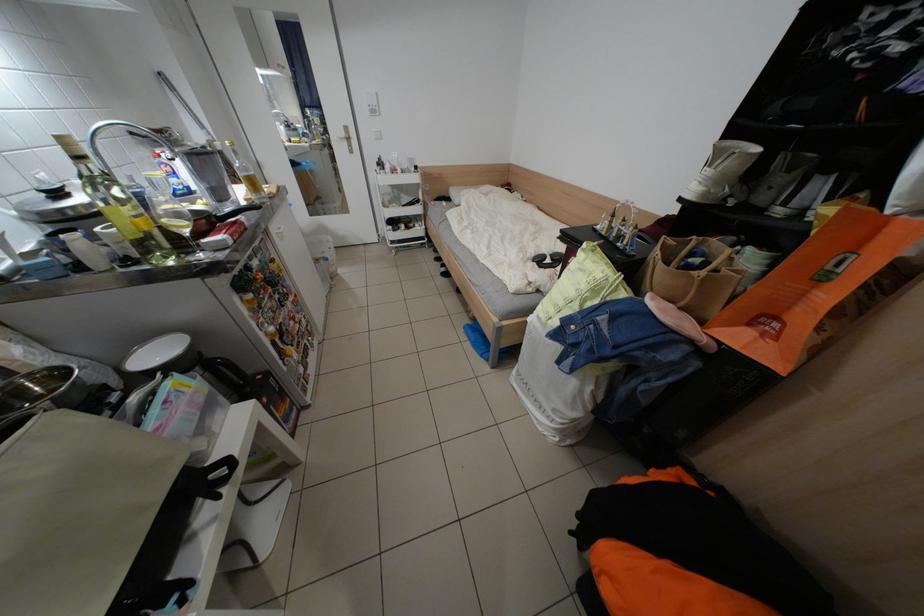
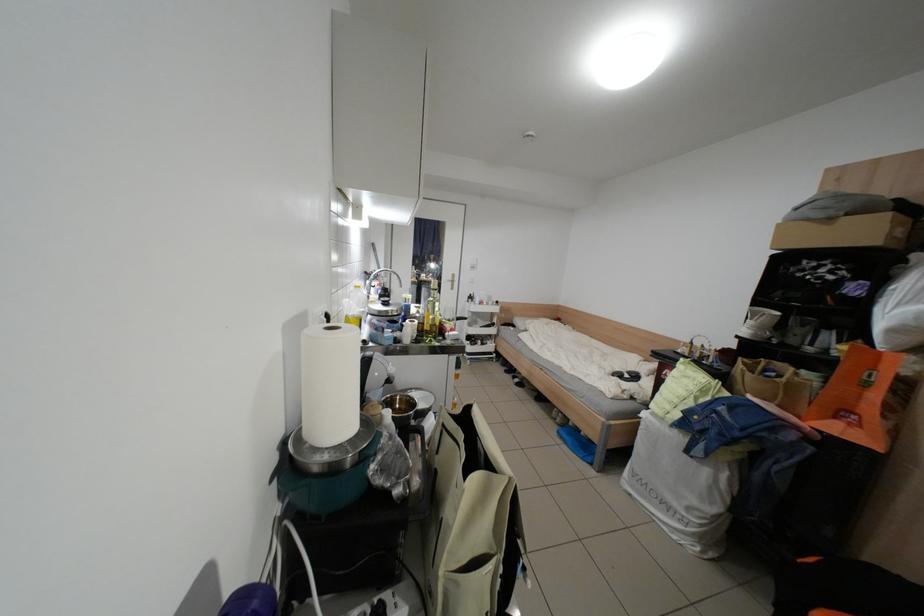
Question: How did the camera likely rotate?

Choices:
 (A) Left
 (B) Right
 (C) Up
 (D) Down

Answer: (C)